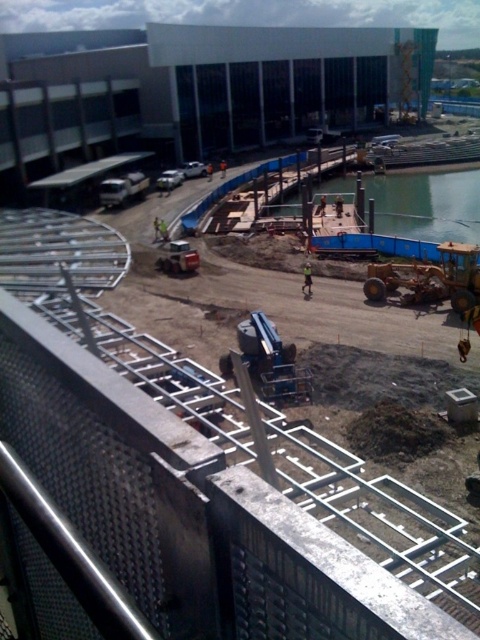
You are a construction supervisor planning to move the yellow rubber tractor at lower right and the metallic blue crane at center to a storage area. If the storage area can only accommodate the smaller of the two, which equipment should you prioritize moving first?

The metallic blue crane at center should be prioritized because it is smaller than the yellow rubber tractor at lower right, so it can fit into the storage area first.

You are standing on a balcony overlooking the construction site. You notice a metallic blue crane at center and a green reflective safety vest at center. Which object is closer to you?

The metallic blue crane at center is positioned under the green reflective safety vest at center, meaning it is closer to you.

You are a safety inspector on the construction site. You need to determine if the metallic blue crane at center can be moved through a narrow pathway that is only wide enough for objects narrower than the green reflective safety vest at center. Based on their widths, can the crane pass through?

The metallic blue crane at center is wider than the green reflective safety vest at center. Since the pathway is only wide enough for objects narrower than the safety vest, the crane cannot pass through the pathway.